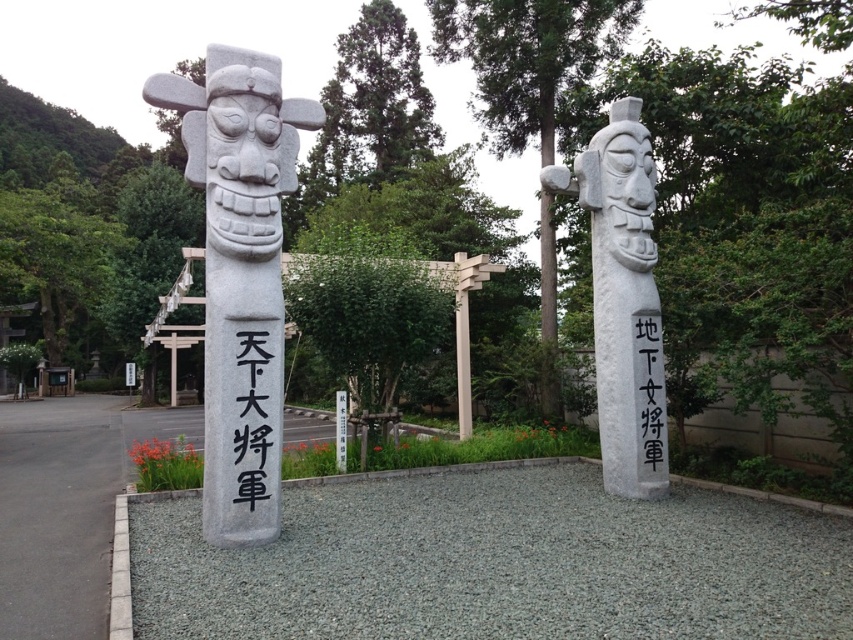
Question: Which point is farther to the camera?

Choices:
 (A) (648, 605)
 (B) (254, 481)
 (C) (231, 492)
 (D) (262, 440)

Answer: (D)

Question: Based on their relative distances, which object is farther from the black stone writing at center?

Choices:
 (A) black stone text at center
 (B) gray gravel at center
 (C) white stone statue at right

Answer: (A)

Question: Can you confirm if white stone statue at right is smaller than white stone pillar at left?

Choices:
 (A) yes
 (B) no

Answer: (B)

Question: Is white stone statue at right to the right of black stone text at center from the viewer's perspective?

Choices:
 (A) yes
 (B) no

Answer: (A)

Question: Is white stone statue at right bigger than black stone text at center?

Choices:
 (A) no
 (B) yes

Answer: (B)

Question: Which is nearer to the black stone text at center?

Choices:
 (A) white stone pillar at left
 (B) gray gravel at center
 (C) black stone writing at center
 (D) white stone statue at right

Answer: (A)